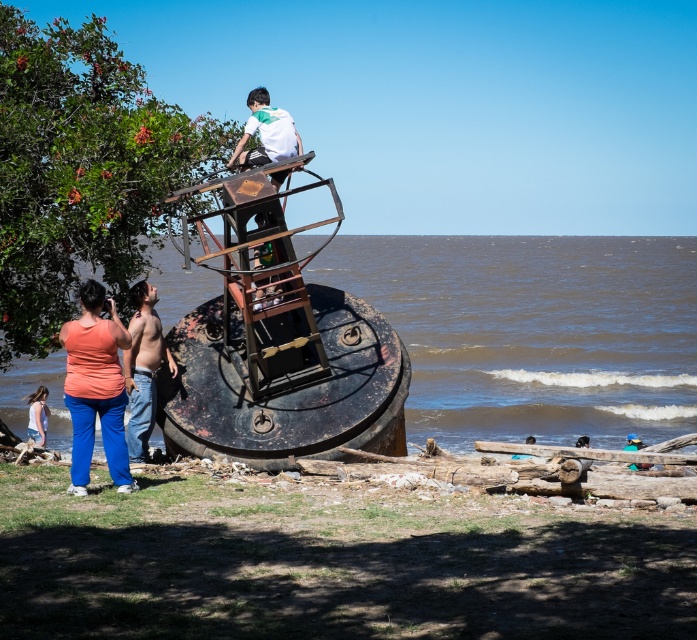
Question: Which object is closer to the camera taking this photo?

Choices:
 (A) shiny metallic torso at lower left
 (B) rusty metal water at center
 (C) green leafy tree at upper left

Answer: (A)

Question: Among these objects, which one is farthest from the camera?

Choices:
 (A) green leafy tree at upper left
 (B) shiny metallic torso at lower left
 (C) matte orange tank top at lower left
 (D) denim shorts at lower left

Answer: (D)

Question: Observing the image, what is the correct spatial positioning of green leafy tree at upper left in reference to denim shorts at lower left?

Choices:
 (A) left
 (B) right

Answer: (A)

Question: Can you confirm if rusty metal water at center is positioned to the left of shiny metallic torso at lower left?

Choices:
 (A) no
 (B) yes

Answer: (A)

Question: Is rusty metal water at center smaller than shiny metallic torso at lower left?

Choices:
 (A) yes
 (B) no

Answer: (B)

Question: Based on their relative distances, which object is nearer to the green leafy tree at upper left?

Choices:
 (A) matte orange tank top at lower left
 (B) denim shorts at lower left
 (C) shiny metallic torso at lower left
 (D) rusty metal water at center

Answer: (A)